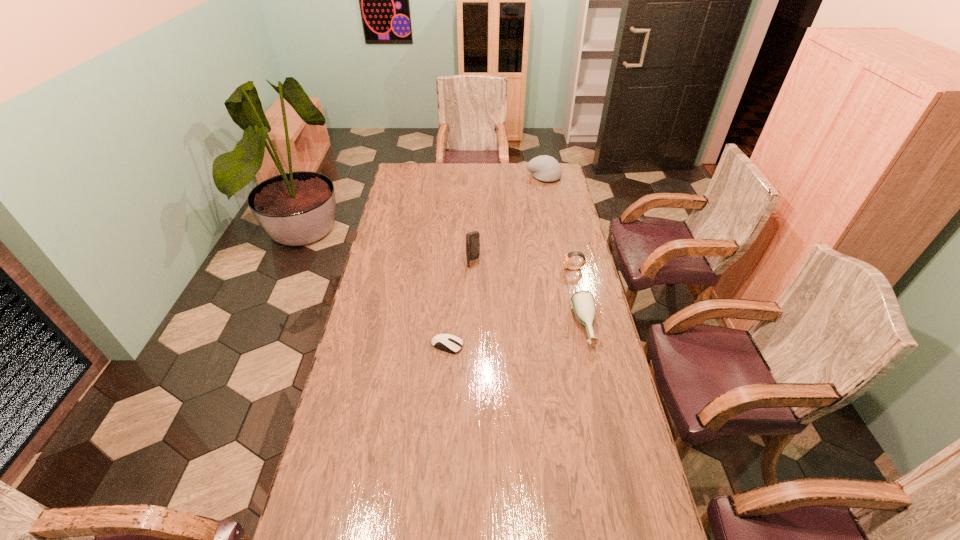
Where is `free space between the bottle and the farthest object`? The width and height of the screenshot is (960, 540). free space between the bottle and the farthest object is located at coordinates (564, 252).

At what (x,y) coordinates should I click in order to perform the action: click on vacant region between the second object from left to right and the bottle. Please return your answer as a coordinate pair (x, y). The width and height of the screenshot is (960, 540). Looking at the image, I should click on (529, 295).

Where is `the fourth closest object to the shortest object`? the fourth closest object to the shortest object is located at coordinates (545, 168).

Where is `object that is the second closest one to the fourth shortest object`? The width and height of the screenshot is (960, 540). object that is the second closest one to the fourth shortest object is located at coordinates (566, 258).

Where is `vacant space that satisfies the following two spatial constraints: 1. on the keyboard of the bottle; 2. on the right side of the tallest object`? The image size is (960, 540). vacant space that satisfies the following two spatial constraints: 1. on the keyboard of the bottle; 2. on the right side of the tallest object is located at coordinates (472, 327).

Locate an element on the screen. free space that satisfies the following two spatial constraints: 1. on the back side of the shortest object; 2. on the left side of the second tallest object is located at coordinates (459, 177).

Locate an element on the screen. The image size is (960, 540). vacant area in the image that satisfies the following two spatial constraints: 1. on the front side of the farthest object; 2. on the right side of the bottle is located at coordinates (574, 327).